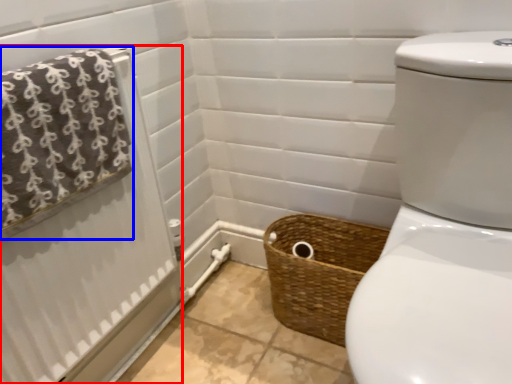
Question: Which object is closer to the camera taking this photo, shower curtain (highlighted by a red box) or bath towel (highlighted by a blue box)?

Choices:
 (A) shower curtain
 (B) bath towel

Answer: (B)